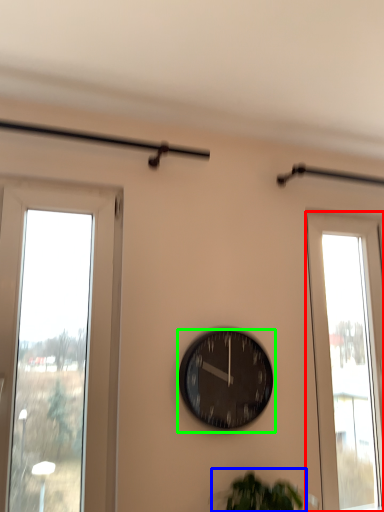
Question: Which is farther away from window (highlighted by a red box)? plant (highlighted by a blue box) or wall clock (highlighted by a green box)?

Choices:
 (A) plant
 (B) wall clock

Answer: (A)